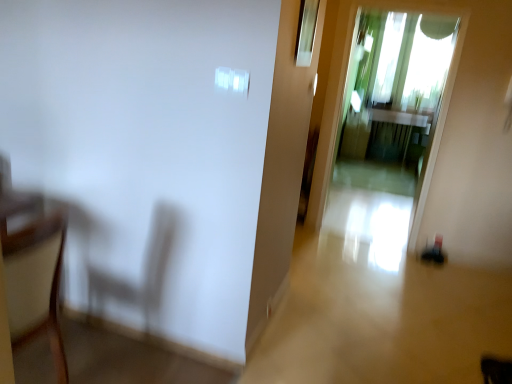
In the scene shown: Measure the distance between point (x=52, y=284) and camera.

Point (x=52, y=284) is 6.13 feet from camera.

Image resolution: width=512 pixels, height=384 pixels. In order to click on wooden armchair at left in this screenshot , I will do `click(36, 284)`.

What are the coordinates of `wooden armchair at left` in the screenshot? It's located at (36, 284).

Is wooden armchair at left beside transparent glass window at upper center?

No, wooden armchair at left is not making contact with transparent glass window at upper center.

Which of these two, wooden armchair at left or transparent glass window at upper center, is wider?

With larger width is wooden armchair at left.

Is wooden armchair at left further to the viewer compared to transparent glass window at upper center?

That is False.

Is point (44, 286) positioned after point (301, 58)?

No.

Is transparent glass window at upper center wider or thinner than transparent glass screen door at center?

transparent glass window at upper center is thinner than transparent glass screen door at center.

From a real-world perspective, relative to transparent glass screen door at center, is transparent glass window at upper center vertically above or below?

transparent glass window at upper center is situated higher than transparent glass screen door at center in the real world.

Consider the image. From the image's perspective, who appears lower, transparent glass window at upper center or transparent glass screen door at center?

transparent glass screen door at center.

Considering the positions of objects wooden armchair at left and transparent glass screen door at center in the image provided, who is more to the right, wooden armchair at left or transparent glass screen door at center?

transparent glass screen door at center.

Can you confirm if wooden armchair at left is wider than transparent glass screen door at center?

Yes.

How much distance is there between wooden armchair at left and transparent glass screen door at center?

The distance of wooden armchair at left from transparent glass screen door at center is 5.52 meters.

Can you confirm if transparent glass screen door at center is smaller than transparent glass window at upper center?

No, transparent glass screen door at center is not smaller than transparent glass window at upper center.

Is transparent glass screen door at center inside the boundaries of transparent glass window at upper center, or outside?

transparent glass screen door at center cannot be found inside transparent glass window at upper center.

In the scene shown: Is transparent glass screen door at center touching transparent glass window at upper center?

transparent glass screen door at center and transparent glass window at upper center are not in contact.

From the image's perspective, is transparent glass screen door at center below transparent glass window at upper center?

Correct, transparent glass screen door at center appears lower than transparent glass window at upper center in the image.

Which of these two, transparent glass window at upper center or wooden armchair at left, stands shorter?

Standing shorter between the two is transparent glass window at upper center.

Is transparent glass window at upper center oriented away from wooden armchair at left?

No, wooden armchair at left is not at the back of transparent glass window at upper center.

Which is more to the right, transparent glass window at upper center or wooden armchair at left?

From the viewer's perspective, transparent glass window at upper center appears more on the right side.

Is wooden armchair at left completely or partially inside transparent glass window at upper center?

No, wooden armchair at left is not surrounded by transparent glass window at upper center.

From a real-world perspective, between transparent glass screen door at center and wooden armchair at left, who is vertically lower?

From a 3D spatial view, wooden armchair at left is below.

Which is more to the left, transparent glass screen door at center or wooden armchair at left?

From the viewer's perspective, wooden armchair at left appears more on the left side.

Between transparent glass screen door at center and wooden armchair at left, which one is positioned behind?

transparent glass screen door at center is behind.

Identify the location of armchair on the left of transparent glass window at upper center. (36, 284).

The height and width of the screenshot is (384, 512). Identify the location of window that is above the transparent glass screen door at center (from the image's perspective). (306, 32).

Consider the image. Which object lies nearer to the anchor point transparent glass window at upper center, transparent glass screen door at center or wooden armchair at left?

wooden armchair at left.

From the image, which object appears to be farther from wooden armchair at left, transparent glass window at upper center or transparent glass screen door at center?

The object further to wooden armchair at left is transparent glass screen door at center.

When comparing their distances from transparent glass window at upper center, does wooden armchair at left or transparent glass screen door at center seem closer?

wooden armchair at left lies closer to transparent glass window at upper center than the other object.

Estimate the real-world distances between objects in this image. Which object is closer to transparent glass screen door at center, wooden armchair at left or transparent glass window at upper center?

The object closer to transparent glass screen door at center is transparent glass window at upper center.

When comparing their distances from wooden armchair at left, does transparent glass screen door at center or transparent glass window at upper center seem further?

transparent glass screen door at center is positioned further to the anchor wooden armchair at left.

Estimate the real-world distances between objects in this image. Which object is closer to transparent glass screen door at center, transparent glass window at upper center or wooden armchair at left?

The object closer to transparent glass screen door at center is transparent glass window at upper center.

This screenshot has width=512, height=384. In order to click on window located between wooden armchair at left and transparent glass screen door at center in the left-right direction in this screenshot , I will do `click(306, 32)`.